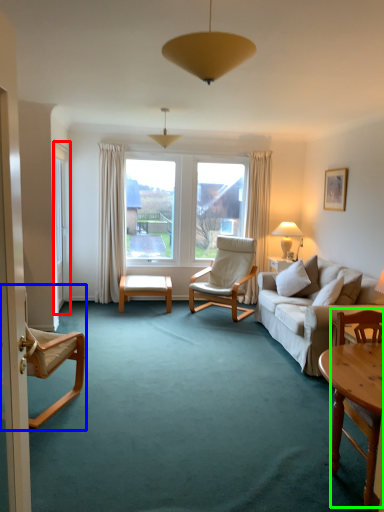
Question: Based on their relative distances, which object is farther from screen door (highlighted by a red box)? Choose from chair (highlighted by a blue box) and chair (highlighted by a green box).

Choices:
 (A) chair
 (B) chair

Answer: (B)